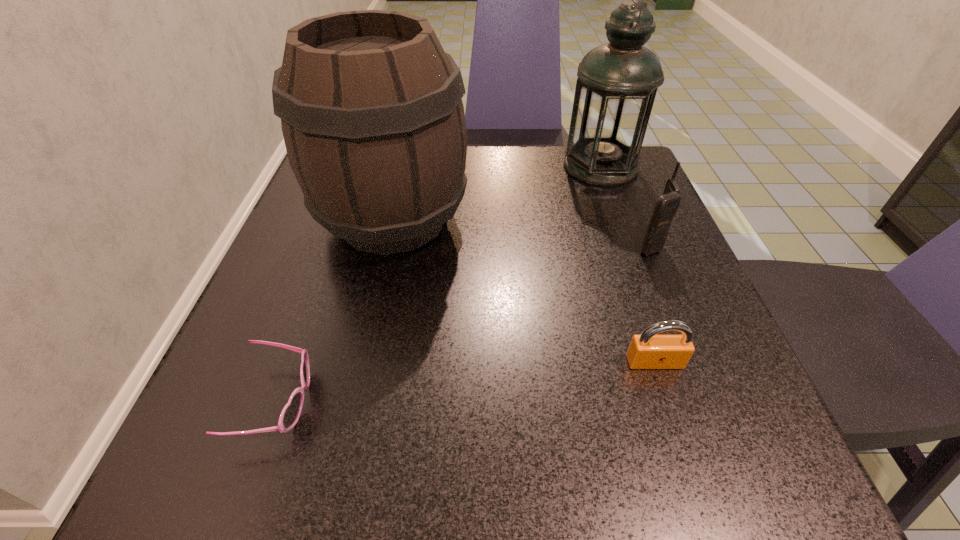
Locate an element on the screen. free spot between the tallest object and the sunglasses is located at coordinates (439, 284).

Image resolution: width=960 pixels, height=540 pixels. Find the location of `free space between the tallest object and the shortest object`. free space between the tallest object and the shortest object is located at coordinates (439, 284).

Identify the location of vacant area between the sunglasses and the tallest object. Image resolution: width=960 pixels, height=540 pixels. (439, 284).

The width and height of the screenshot is (960, 540). Find the location of `free space between the padlock and the wine bucket`. free space between the padlock and the wine bucket is located at coordinates (524, 291).

Locate an element on the screen. This screenshot has width=960, height=540. free space between the third tallest object and the padlock is located at coordinates (652, 303).

Where is `free space between the third shortest object and the tallest object`? free space between the third shortest object and the tallest object is located at coordinates (625, 205).

Image resolution: width=960 pixels, height=540 pixels. Find the location of `vacant space that's between the oil lamp and the padlock`. vacant space that's between the oil lamp and the padlock is located at coordinates (628, 264).

Locate an element on the screen. This screenshot has width=960, height=540. empty space between the cellular telephone and the padlock is located at coordinates (652, 303).

The height and width of the screenshot is (540, 960). I want to click on the second closest object to the tallest object, so click(x=371, y=109).

Select which object is the fourth closest to the third shortest object. Please provide its 2D coordinates. Your answer should be formatted as a tuple, i.e. [(x, y)], where the tuple contains the x and y coordinates of a point satisfying the conditions above.

[(290, 414)]